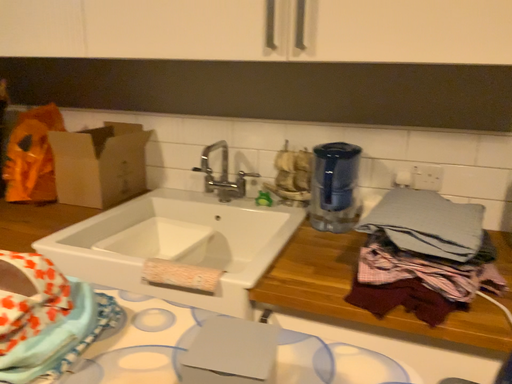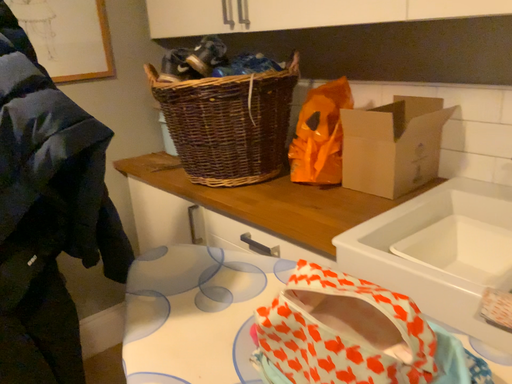
Question: Which way did the camera rotate in the video?

Choices:
 (A) rotated left
 (B) rotated right

Answer: (A)